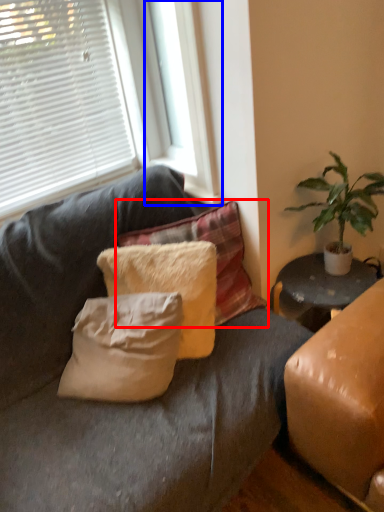
Question: Which point is further to the camera, pillow (highlighted by a red box) or window frame (highlighted by a blue box)?

Choices:
 (A) pillow
 (B) window frame

Answer: (A)